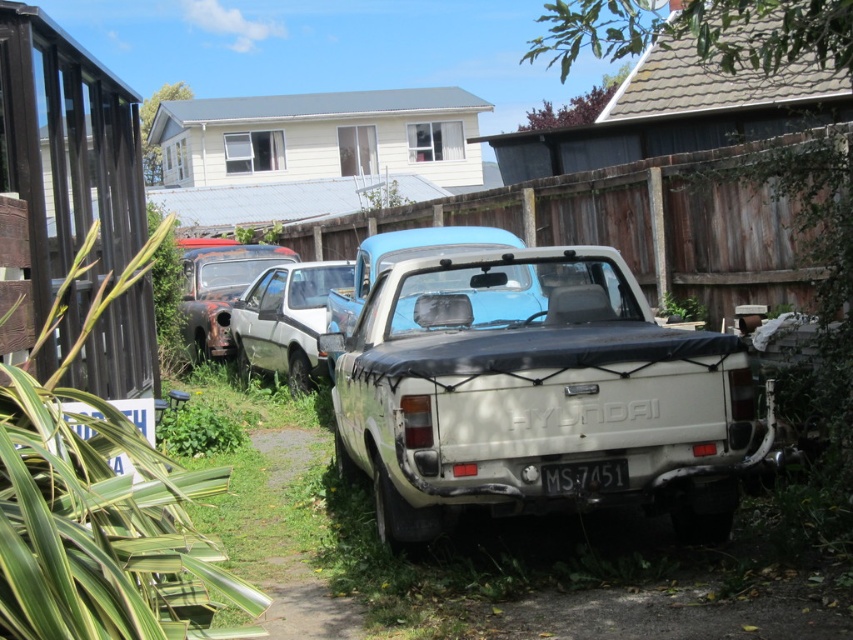
Does green leafy plant at left have a smaller size compared to white matte hatchback at center?

Yes.

Locate an element on the screen. Image resolution: width=853 pixels, height=640 pixels. green leafy plant at left is located at coordinates (100, 508).

This screenshot has width=853, height=640. What are the coordinates of `green leafy plant at left` in the screenshot? It's located at (100, 508).

Between rusty metal car at left and white plastic license plate at center, which one appears on the right side from the viewer's perspective?

white plastic license plate at center is more to the right.

Is rusty metal car at left closer to the viewer compared to white plastic license plate at center?

No, it is not.

Looking at this image, who is more forward, (x=187, y=296) or (x=566, y=480)?

Point (x=566, y=480)

Where is `rusty metal car at left`? rusty metal car at left is located at coordinates (219, 291).

Is white matte pickup truck at center bigger than white plastic license plate at center?

Indeed, white matte pickup truck at center has a larger size compared to white plastic license plate at center.

From the picture: Does white matte pickup truck at center have a lesser height compared to white plastic license plate at center?

No.

Where is `white matte pickup truck at center`? This screenshot has width=853, height=640. white matte pickup truck at center is located at coordinates (537, 392).